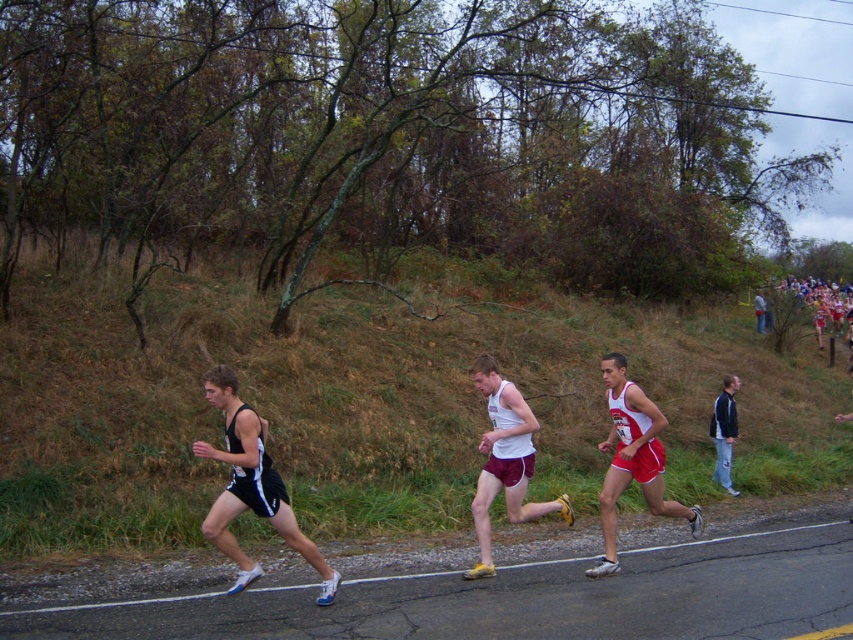
Which is more to the right, white matte tank top at center or red fabric jacket at right?

Positioned to the right is red fabric jacket at right.

Does white matte tank top at center have a larger size compared to red fabric jacket at right?

Yes, white matte tank top at center is bigger than red fabric jacket at right.

This screenshot has width=853, height=640. I want to click on white matte tank top at center, so click(x=505, y=461).

Measure the distance between point (323,586) and camera.

Point (323,586) and camera are 7.14 meters apart.

In the scene shown: Between black mesh tank top at left and white jersey at center, which one appears on the right side from the viewer's perspective?

Positioned to the right is white jersey at center.

Between point (235, 552) and point (607, 522), which one is positioned in front?

Positioned in front is point (235, 552).

Locate an element on the screen. The width and height of the screenshot is (853, 640). black mesh tank top at left is located at coordinates (251, 486).

Which is below, white jersey at center or white matte tank top at center?

white jersey at center is lower down.

Looking at this image, is white jersey at center behind white matte tank top at center?

No.

Identify the location of white jersey at center. (631, 460).